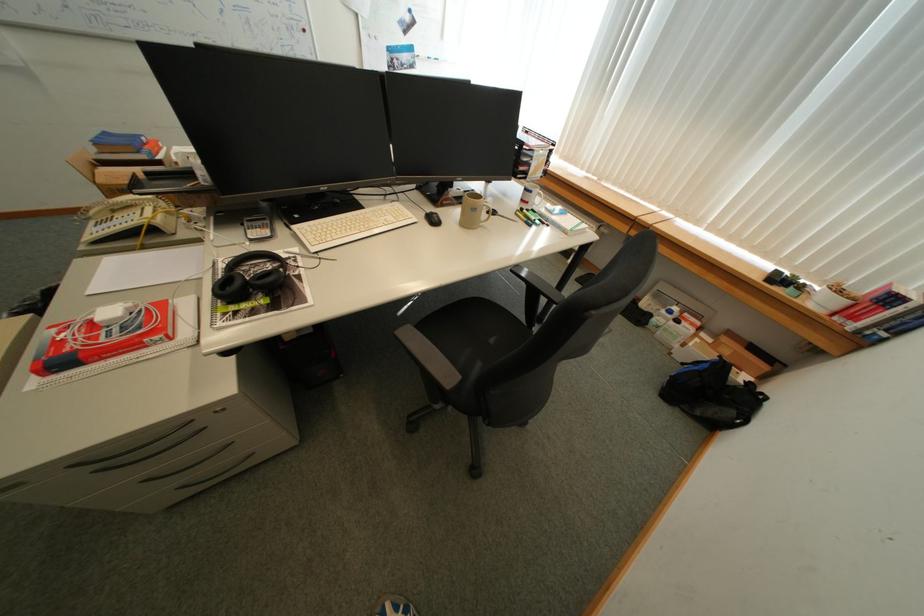
Where would you wear the black headphones? Please return your answer as a coordinate pair (x, y).

(249, 277)